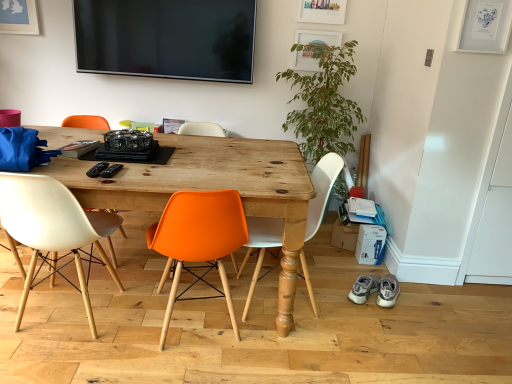
Question: Considering the positions of gray suede sneakers at lower right, the second footwear viewed from the right, and wooden table at center in the image, is gray suede sneakers at lower right, the second footwear viewed from the right, bigger or smaller than wooden table at center?

Choices:
 (A) small
 (B) big

Answer: (A)

Question: Considering their positions, is gray suede sneakers at lower right, the second footwear viewed from the right, located in front of or behind wooden table at center?

Choices:
 (A) front
 (B) behind

Answer: (B)

Question: Which object is positioned farthest from the wooden table at center?

Choices:
 (A) orange plastic chair at center, which appears as the second chair when viewed from the right
 (B) gray suede sneakers at lower right, positioned as the first footwear in right-to-left order
 (C) matte white chair at left, arranged as the 3th chair when viewed from the right
 (D) green leafy plant at right
 (E) gray suede sneakers at lower right, positioned as the first footwear in left-to-right order

Answer: (B)

Question: Which object is positioned closest to the white matte chair at center, acting as the 1th chair starting from the right?

Choices:
 (A) green leafy plant at right
 (B) gray suede sneakers at lower right, the second footwear viewed from the right
 (C) orange plastic chair at center, which appears as the 2th chair when viewed from the left
 (D) wooden table at center
 (E) gray suede sneakers at lower right, acting as the second footwear starting from the left

Answer: (D)